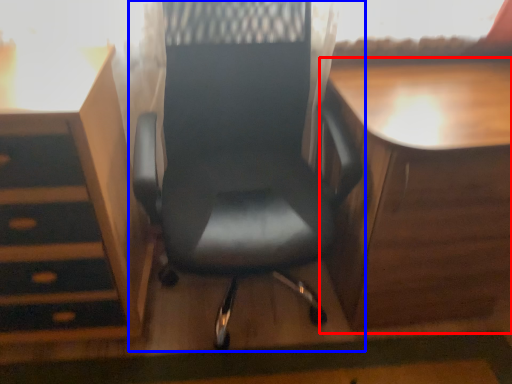
Question: Which point is closer to the camera, table (highlighted by a red box) or chair (highlighted by a blue box)?

Choices:
 (A) table
 (B) chair

Answer: (B)